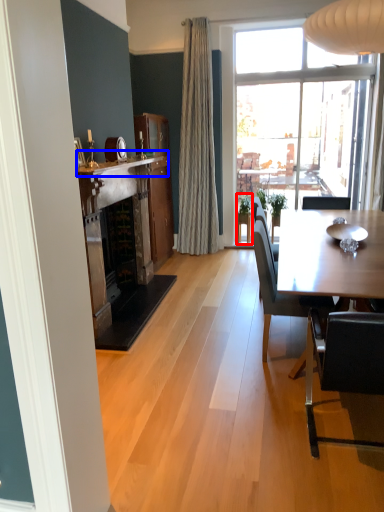
Question: Which object appears closest to the camera in this image, houseplant (highlighted by a red box) or mantle (highlighted by a blue box)?

Choices:
 (A) houseplant
 (B) mantle

Answer: (B)